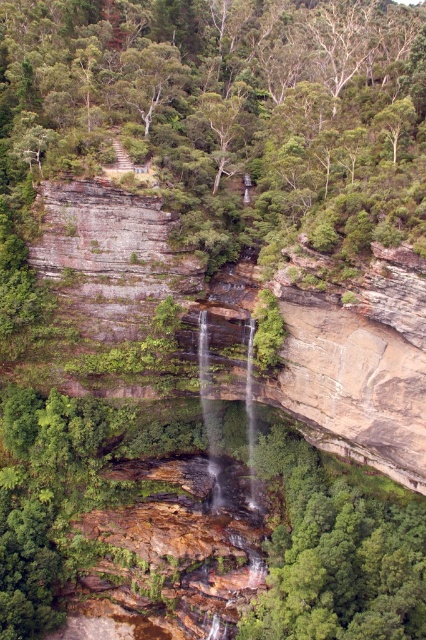
You are a park ranger planning to install a safety barrier between the green leafy tree at center and the brown rough cliff at center. Which object requires a wider barrier section to accommodate its size?

The green leafy tree at center requires a wider barrier section because its width surpasses that of the brown rough cliff at center.

You are a hiker planning to take a photo of the brown rough cliff at center from the green leafy tree at center. Which direction should you face to get the cliff in your view?

The green leafy tree at center is to the left of the brown rough cliff at center, so you should face to the right from the green leafy tree at center to see the brown rough cliff at center.

You are a hiker who wants to cross from the green leafy tree at center to the brown rough cliff at center. The path you plan to take is 20 meters long. Will you be able to reach the cliff from the tree without needing to go around?

The distance between the green leafy tree at center and the brown rough cliff at center is 22.39 meters. Since your path is only 20 meters long, you will not be able to reach the cliff without needing to go around.